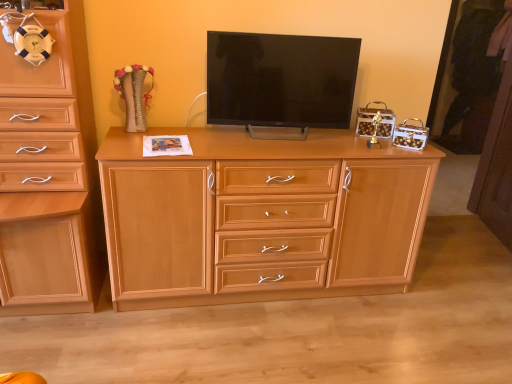
Question: Can you confirm if light wood chest of drawers at center, marked as the first chest of drawers in a right-to-left arrangement, is wider than matte black tv at center?

Choices:
 (A) no
 (B) yes

Answer: (B)

Question: From the image's perspective, is light wood chest of drawers at center, placed as the second chest of drawers when sorted from left to right, located beneath matte black tv at center?

Choices:
 (A) no
 (B) yes

Answer: (B)

Question: Does light wood chest of drawers at center, placed as the second chest of drawers when sorted from left to right, come behind matte black tv at center?

Choices:
 (A) no
 (B) yes

Answer: (A)

Question: From a real-world perspective, is light wood chest of drawers at center, marked as the first chest of drawers in a right-to-left arrangement, over matte black tv at center?

Choices:
 (A) no
 (B) yes

Answer: (A)

Question: Considering the relative sizes of light wood chest of drawers at center, placed as the second chest of drawers when sorted from left to right, and matte black tv at center in the image provided, is light wood chest of drawers at center, placed as the second chest of drawers when sorted from left to right, taller than matte black tv at center?

Choices:
 (A) no
 (B) yes

Answer: (B)

Question: Is light wood cabinet at left, the 1th chest of drawers from the left, wider or thinner than light wood chest of drawers at center, placed as the second chest of drawers when sorted from left to right?

Choices:
 (A) wide
 (B) thin

Answer: (A)

Question: Considering the positions of point (40, 18) and point (221, 238), is point (40, 18) closer or farther from the camera than point (221, 238)?

Choices:
 (A) closer
 (B) farther

Answer: (A)

Question: From a real-world perspective, is light wood cabinet at left, the 1th chest of drawers from the left, above or below light wood chest of drawers at center, marked as the first chest of drawers in a right-to-left arrangement?

Choices:
 (A) below
 (B) above

Answer: (B)

Question: Considering the positions of light wood cabinet at left, arranged as the 2th chest of drawers when viewed from the right, and light wood chest of drawers at center, marked as the first chest of drawers in a right-to-left arrangement, in the image, is light wood cabinet at left, arranged as the 2th chest of drawers when viewed from the right, bigger or smaller than light wood chest of drawers at center, marked as the first chest of drawers in a right-to-left arrangement,?

Choices:
 (A) big
 (B) small

Answer: (B)

Question: Considering the positions of matte black tv at center and light wood chest of drawers at center, placed as the second chest of drawers when sorted from left to right, in the image, is matte black tv at center wider or thinner than light wood chest of drawers at center, placed as the second chest of drawers when sorted from left to right,?

Choices:
 (A) wide
 (B) thin

Answer: (B)

Question: From the image's perspective, relative to light wood chest of drawers at center, marked as the first chest of drawers in a right-to-left arrangement, is matte black tv at center above or below?

Choices:
 (A) above
 (B) below

Answer: (A)

Question: Choose the correct answer: Is matte black tv at center inside light wood chest of drawers at center, placed as the second chest of drawers when sorted from left to right, or outside it?

Choices:
 (A) inside
 (B) outside

Answer: (B)

Question: Considering the positions of matte black tv at center and light wood chest of drawers at center, placed as the second chest of drawers when sorted from left to right, in the image, is matte black tv at center taller or shorter than light wood chest of drawers at center, placed as the second chest of drawers when sorted from left to right,?

Choices:
 (A) short
 (B) tall

Answer: (A)

Question: From a real-world perspective, is light wood cabinet at left, arranged as the 2th chest of drawers when viewed from the right, positioned above or below matte black tv at center?

Choices:
 (A) above
 (B) below

Answer: (B)

Question: Choose the correct answer: Is light wood cabinet at left, the 1th chest of drawers from the left, inside matte black tv at center or outside it?

Choices:
 (A) outside
 (B) inside

Answer: (A)